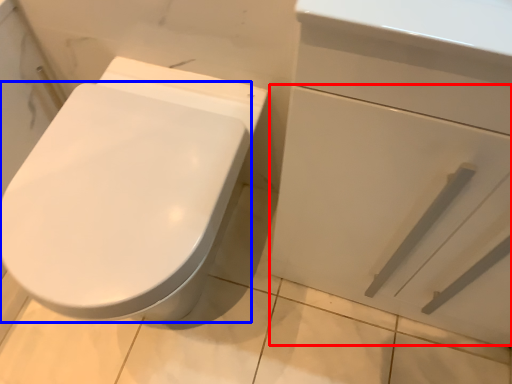
Question: Which of the following is the farthest to the observer, drawer (highlighted by a red box) or bidet (highlighted by a blue box)?

Choices:
 (A) drawer
 (B) bidet

Answer: (B)